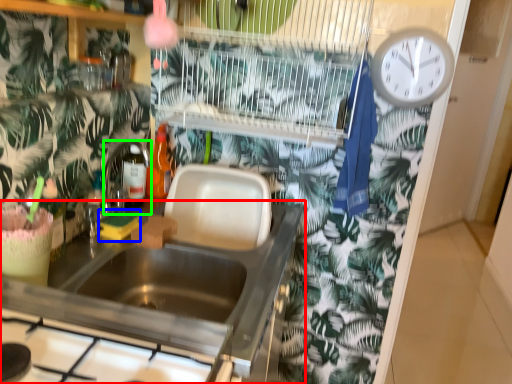
Question: Which object is the farthest from countertop (highlighted by a red box)? Choose among these: food (highlighted by a blue box) or faucet (highlighted by a green box).

Choices:
 (A) food
 (B) faucet

Answer: (B)